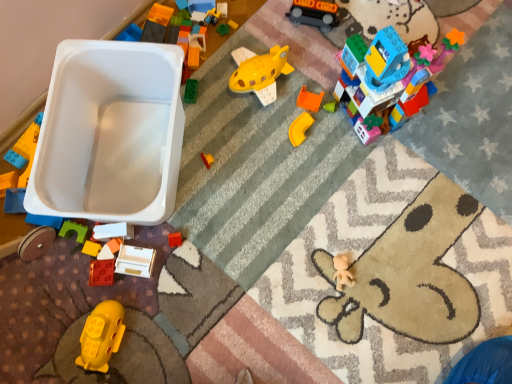
Identify the location of free space in front of shiny black train at upper center, arranged as the 1th toy when viewed from the top. (310, 67).